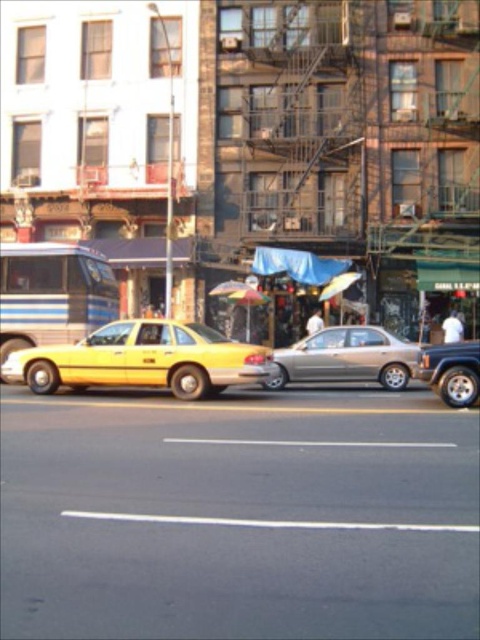
Question: Is satin gold sedan at center smaller than metallic silver suv at right?

Choices:
 (A) yes
 (B) no

Answer: (B)

Question: Does satin gold sedan at center have a lesser width compared to translucent plastic umbrella at center?

Choices:
 (A) yes
 (B) no

Answer: (B)

Question: Is shiny yellow taxi at center below satin gold sedan at center?

Choices:
 (A) yes
 (B) no

Answer: (A)

Question: Considering the real-world distances, which object is closest to the metallic silver suv at right?

Choices:
 (A) translucent plastic umbrella at center
 (B) satin gold sedan at center
 (C) shiny yellow taxi at center

Answer: (B)

Question: Which of the following is the closest to the observer?

Choices:
 (A) pyautogui.click(x=260, y=372)
 (B) pyautogui.click(x=440, y=353)
 (C) pyautogui.click(x=305, y=344)
 (D) pyautogui.click(x=227, y=300)

Answer: (B)

Question: Which of the following is the farthest from the observer?

Choices:
 (A) (380, 330)
 (B) (69, 369)
 (C) (256, 304)
 (D) (470, 376)

Answer: (C)